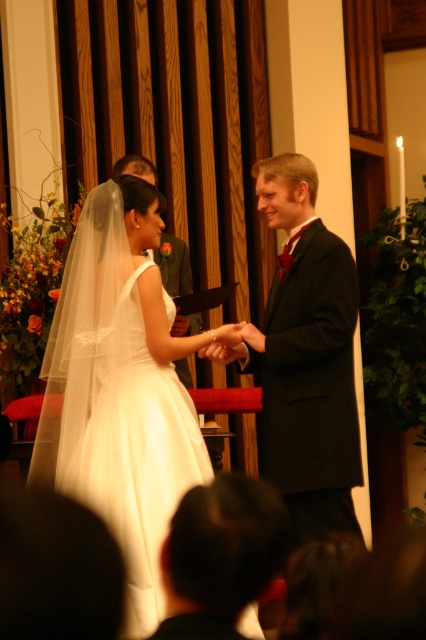
Question: Is white satin dress at center wider than smooth black suit at center?

Choices:
 (A) yes
 (B) no

Answer: (A)

Question: Which point is farther to the camera?

Choices:
 (A) white satin dress at center
 (B) smooth black suit at center

Answer: (B)

Question: Estimate the real-world distances between objects in this image. Which object is farther from the white satin dress at center?

Choices:
 (A) black satin suit at center
 (B) smooth black suit at center

Answer: (B)

Question: Which object is positioned farthest from the white satin dress at center?

Choices:
 (A) black satin suit at center
 (B) smooth black suit at center

Answer: (B)

Question: Is white satin dress at center further to the viewer compared to black satin suit at center?

Choices:
 (A) yes
 (B) no

Answer: (B)

Question: Can you confirm if white satin dress at center is wider than black satin suit at center?

Choices:
 (A) no
 (B) yes

Answer: (B)